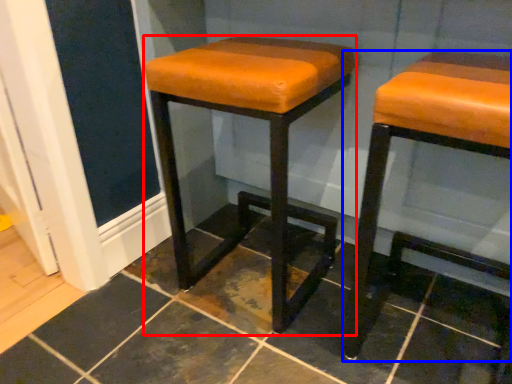
Question: Which object appears farthest to the camera in this image, stool (highlighted by a red box) or stool (highlighted by a blue box)?

Choices:
 (A) stool
 (B) stool

Answer: (A)